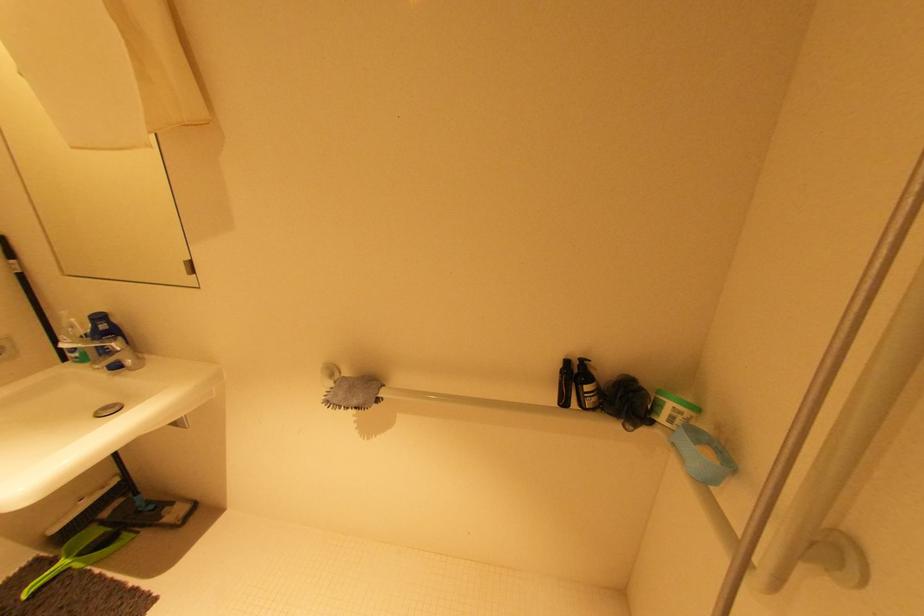
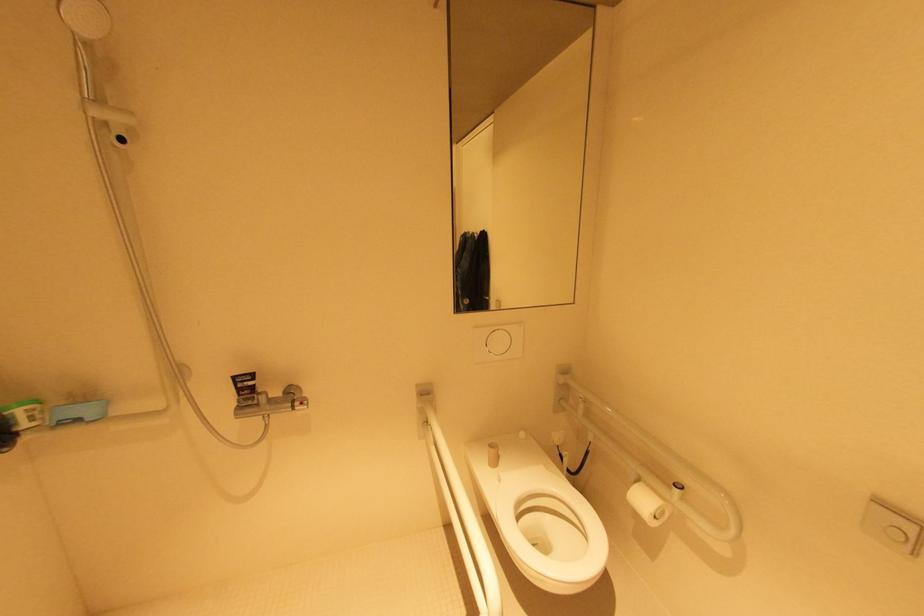
How did the camera likely rotate?

The rotation direction of the camera is right-down.